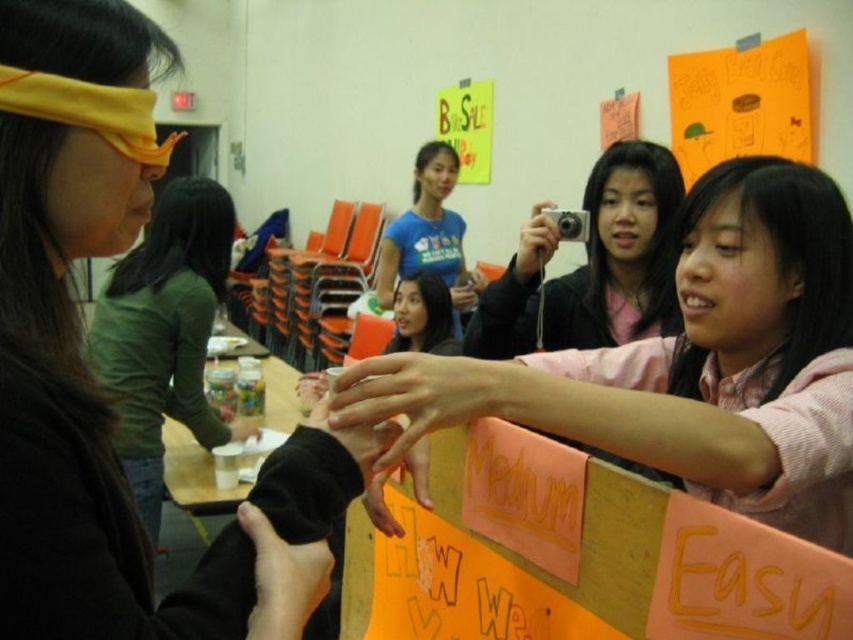
You are standing in the room and want to reach the point marked as point (28,20). Can you estimate how far you need to move to get there?

The point (28,20) is 22.25 inches away from the viewer, so you need to move approximately 22.25 inches to reach it.